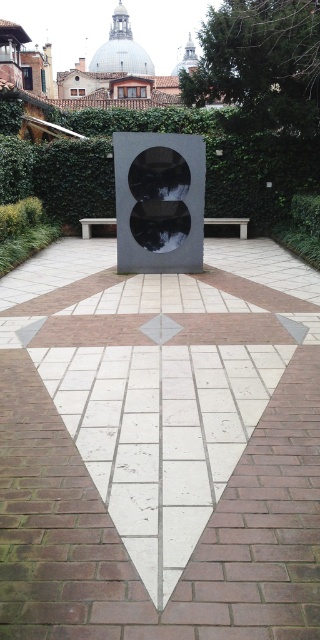
You are a visitor in the garden and want to sit on the smooth gray bench at center. To your left, there is a path leading towards the polished black stone sculpture at center. If you walk straight from the bench, which direction will you face relative to the sculpture?

The polished black stone sculpture at center is to the right of the smooth gray bench at center. If you walk straight from the bench, you will be facing away from the sculpture, as it is positioned to your right side.

You are standing in the courtyard and want to walk from the point closer to you to the point further away. Which path should you take? The two points are point (x=222, y=220) and point (x=245, y=221). Please describe the direction you need to walk based on their positions.

You should walk towards the direction of increasing y coordinates since point (x=245, y=221) is further away from you compared to point (x=222, y=220). Therefore, moving in the direction where the y value increases will take you from the closer point to the farther one.